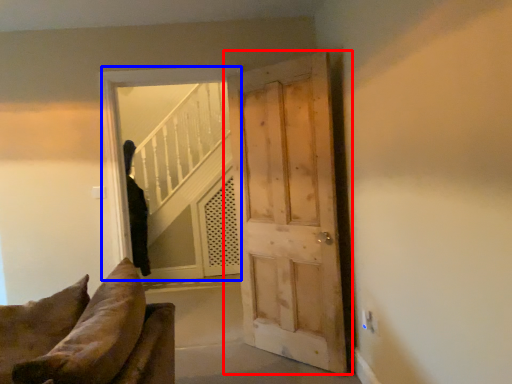
Question: Among these objects, which one is nearest to the camera, door (highlighted by a red box) or window (highlighted by a blue box)?

Choices:
 (A) door
 (B) window

Answer: (A)